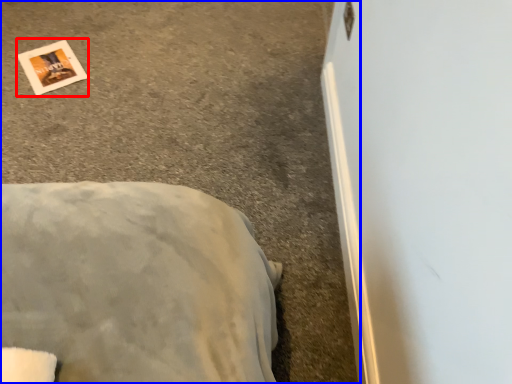
Question: Which point is further to the camera, postcard (highlighted by a red box) or concrete (highlighted by a blue box)?

Choices:
 (A) postcard
 (B) concrete

Answer: (A)